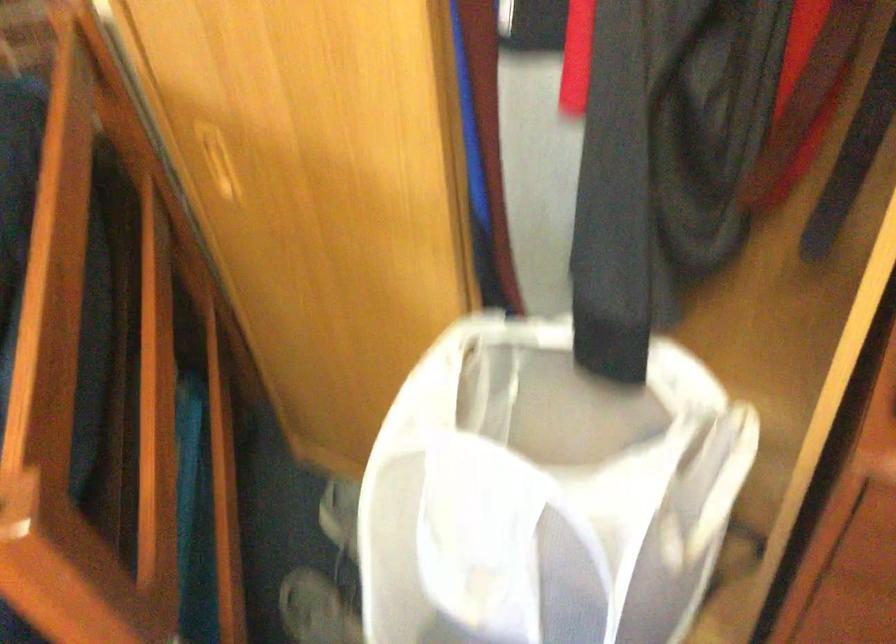
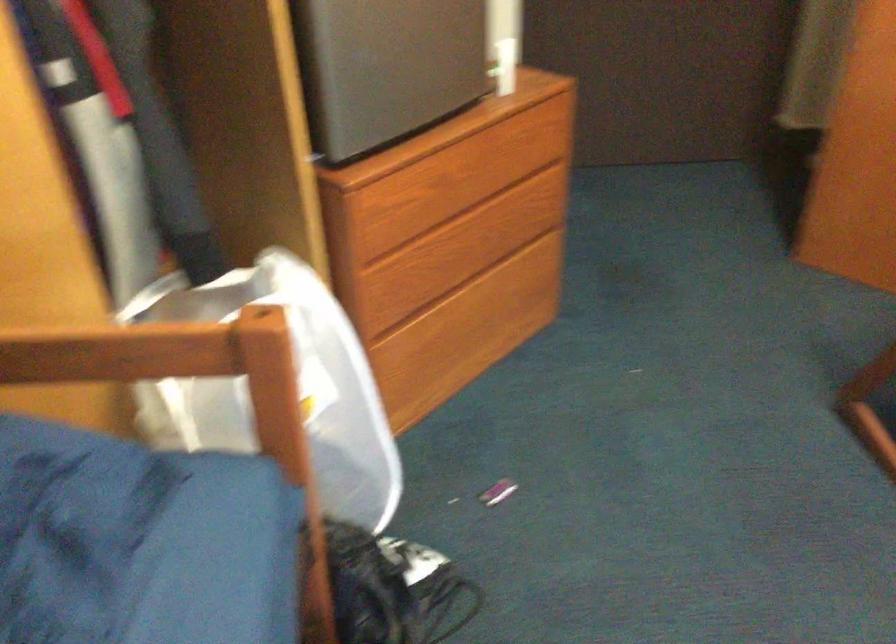
Question: How did the camera likely rotate?

Choices:
 (A) Left
 (B) Right
 (C) Up
 (D) Down

Answer: (B)